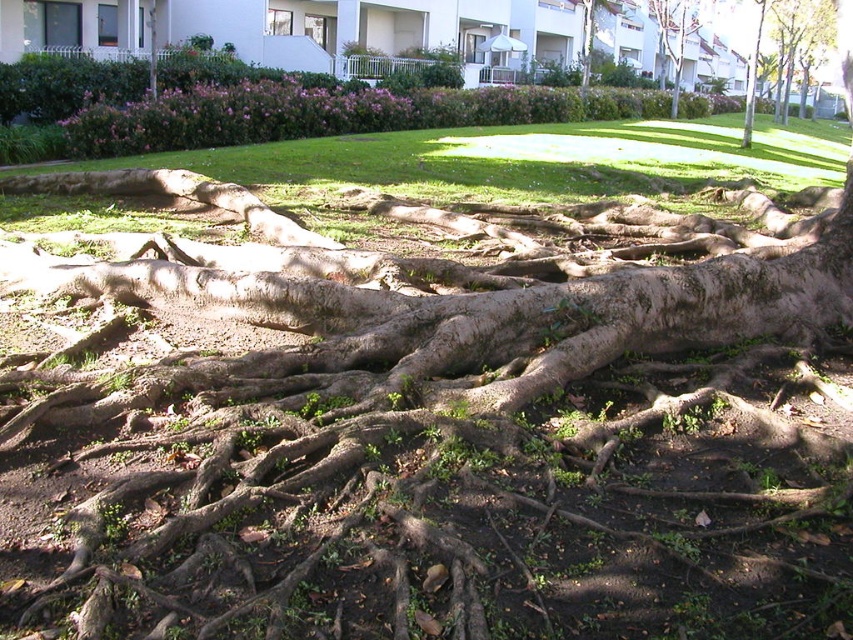
You are standing in the garden and want to walk from the green grass at center to the green rough bark tree at upper center. Which direction should you head towards?

The green grass at center is to the left of the green rough bark tree at upper center, so you should head towards the right to reach the tree.

You are planning to place a picnic blanket in the area where the green grass at center and brown rough tree at upper center are located. Which area is more suitable for placing the blanket based on their widths?

The green grass at center is wider than the brown rough tree at upper center, so placing the picnic blanket on the green grass at center would be more suitable as it provides a larger space.